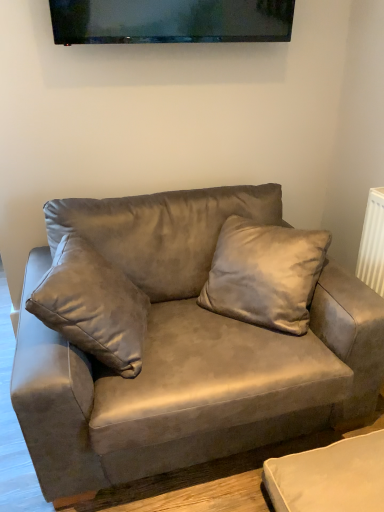
Question: Does point (96, 36) appear closer or farther from the camera than point (196, 211)?

Choices:
 (A) closer
 (B) farther

Answer: (A)

Question: Which is correct: matte black tv at upper center is inside suede gray couch at center, or outside of it?

Choices:
 (A) inside
 (B) outside

Answer: (B)

Question: Which object is positioned closest to the suede pillow at center?

Choices:
 (A) suede gray couch at center
 (B) matte black tv at upper center

Answer: (A)

Question: Considering the real-world distances, which object is farthest from the matte black tv at upper center?

Choices:
 (A) suede pillow at center
 (B) suede gray couch at center

Answer: (B)